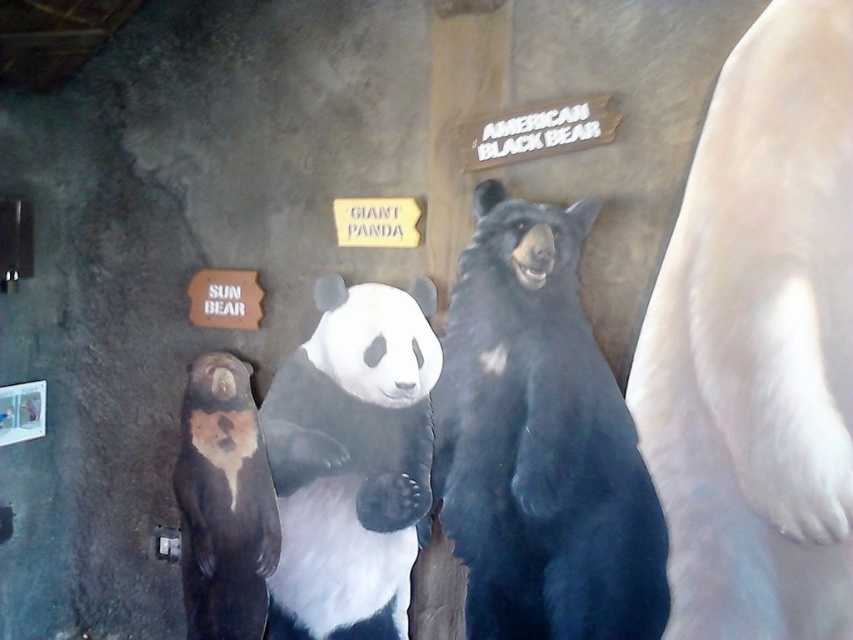
You are a museum visitor who wants to take a photo of both the white matte panda at center and the brown matte sun bear at left. Since you can only focus on one bear at a time, which one should you focus on first to ensure both are in the frame?

You should focus on the brown matte sun bear at left first because the white matte panda at center is positioned to its right. By centering the brown matte sun bear at left in your viewfinder, you can adjust the camera to include the white matte panda at center on the right side of the frame.

You are a museum visitor standing in front of the bear display. You want to take a photo of the white matte panda at center and the brown matte sun bear at left. Which bear will appear larger in your photo?

The white matte panda at center will appear larger in your photo because it is closer to the viewer than the brown matte sun bear at left.

You are a visitor at the exhibit and want to take a photo of both the black furry bear at center and the white matte panda at center. Which bear should you position to your left side in the frame to capture both in one shot?

You should position the white matte panda at center to your left side in the frame because the black furry bear at center is to the right of it, ensuring both are included in the shot.